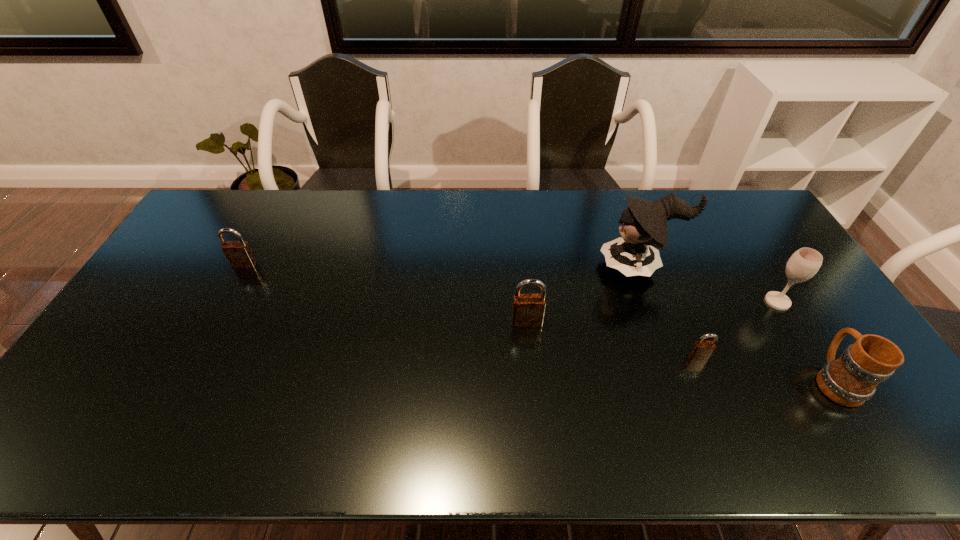
To ensure equal spacing by inserting another padlock among them, please point out a vacant spot for this new padlock. Please provide its 2D coordinates. Your answer should be formatted as a tuple, i.e. [(x, y)], where the tuple contains the x and y coordinates of a point satisfying the conditions above.

[(377, 291)]